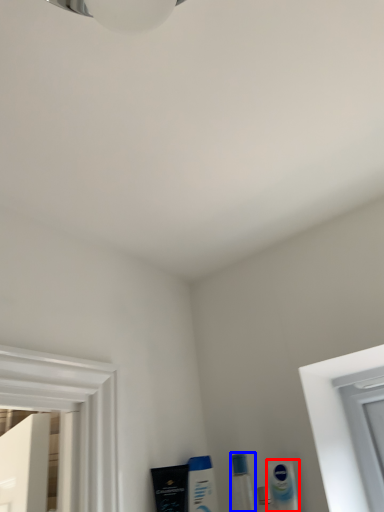
Question: Among these objects, which one is farthest to the camera, mouthwash (highlighted by a red box) or toiletry (highlighted by a blue box)?

Choices:
 (A) mouthwash
 (B) toiletry

Answer: (A)